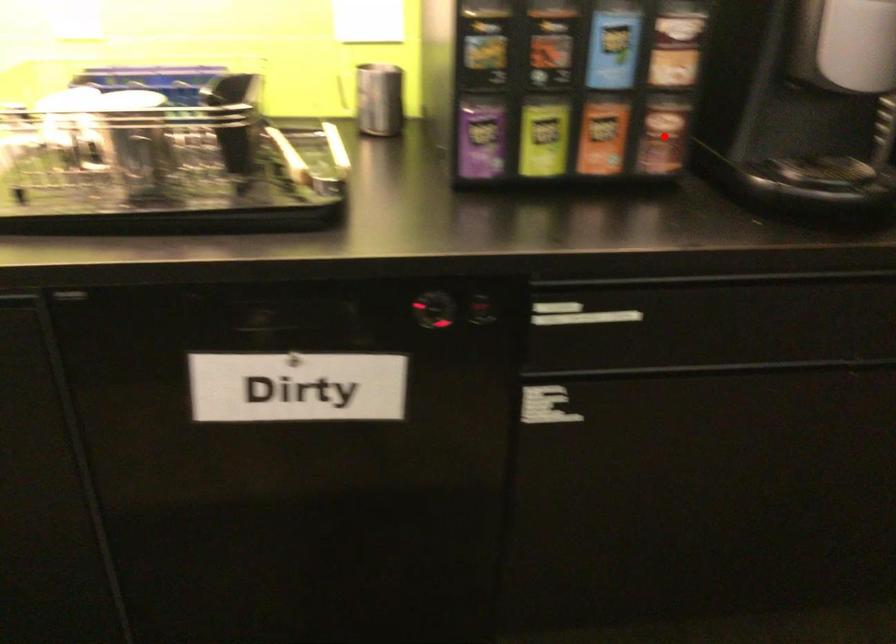
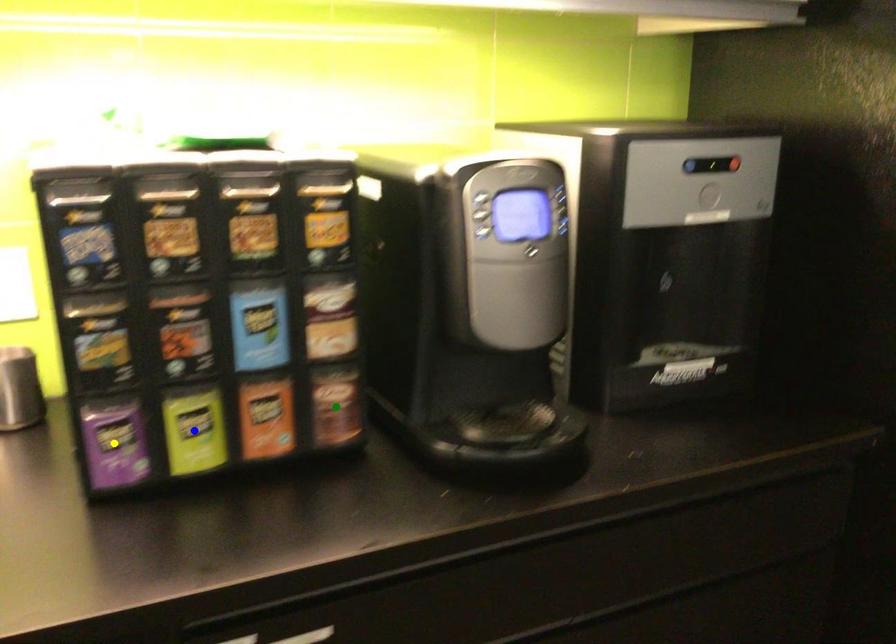
Question: I am providing you with two images of the same scene from different viewpoints. A red point is marked on the first image. You are given multiple points on the second image. Which point in image 2 is actually the same real-world point as the red point in image 1?

Choices:
 (A) blue point
 (B) yellow point
 (C) green point

Answer: (C)